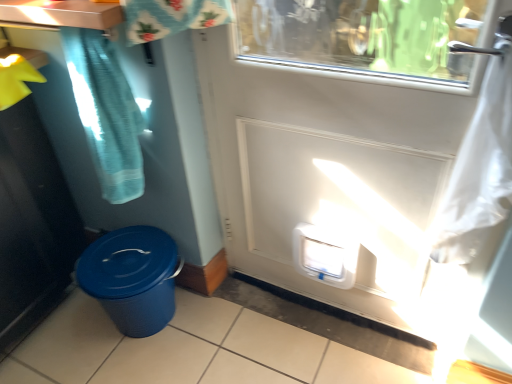
Question: From their relative heights in the image, would you say white plastic door at center is taller or shorter than teal fabric shower curtain at upper left?

Choices:
 (A) short
 (B) tall

Answer: (B)

Question: Is white plastic door at center in front of or behind teal fabric shower curtain at upper left in the image?

Choices:
 (A) behind
 (B) front

Answer: (B)

Question: Based on their relative distances, which object is farther from the teal fabric shower curtain at upper left?

Choices:
 (A) white plastic water cooler at lower center
 (B) brushed metal counter top at upper left
 (C) blue textured plastic bin at lower left
 (D) white plastic door at center

Answer: (A)

Question: Based on their relative distances, which object is nearer to the blue textured plastic bin at lower left?

Choices:
 (A) teal fabric shower curtain at upper left
 (B) white plastic door at center
 (C) white plastic water cooler at lower center
 (D) brushed metal counter top at upper left

Answer: (A)